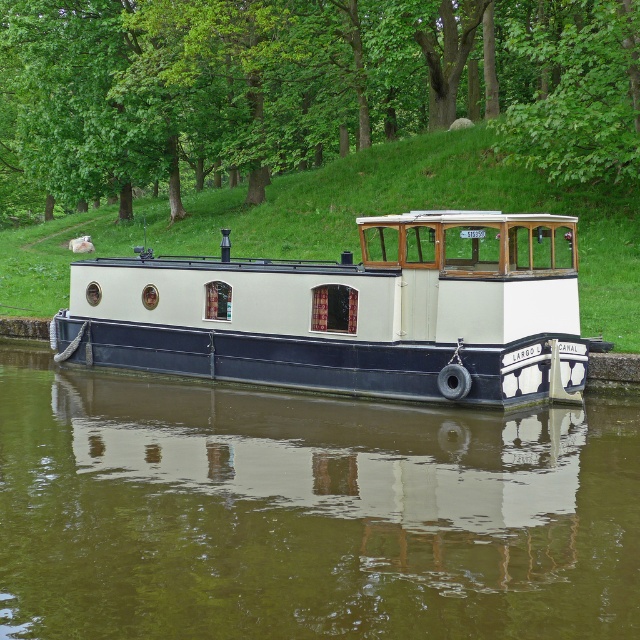
Based on the scene of a narrowboat moored on a canal with greenish water at center and a green leafy tree at upper center, which object takes up more space in the image?

The green leafy tree at upper center occupies more space than the greenish water at center in the image.

Looking at this image, you are a photographer planning to capture the white matte boat at center and the green leafy tree at upper center in a single frame. Based on their widths, which object might require you to adjust your camera angle to ensure both fit horizontally within the shot?

The green leafy tree at upper center might be wider than the white matte boat at center, so adjusting the camera angle to accommodate its width would be necessary to include both in the frame.

You are a photographer planning to take a wide shot of the white matte boat at center and the greenish water at center from the canal bank. Based on the scene, which object will appear wider in your photo?

The white matte boat at center appears wider in the photo because it has a greater width than the greenish water at center.